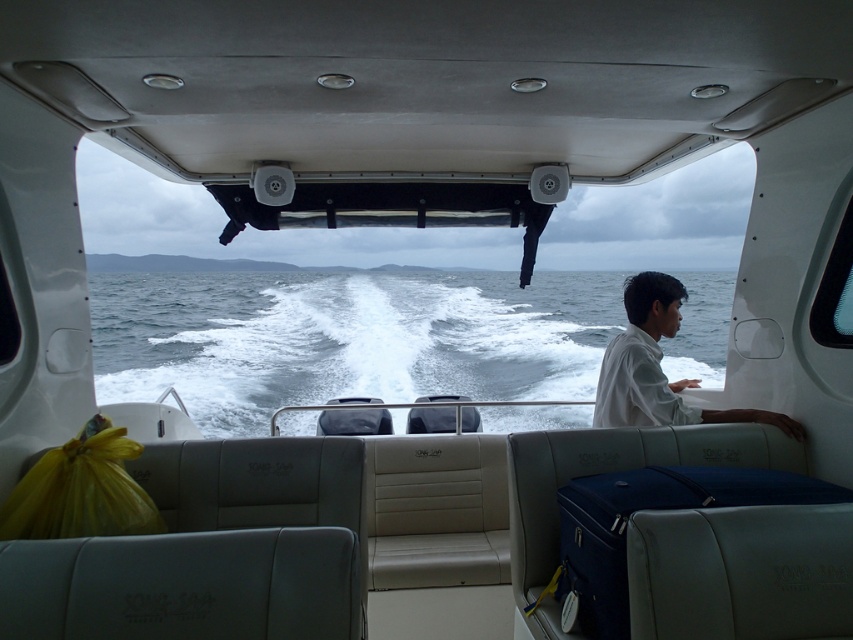
Who is lower down, white foamy water at center or white matte shirt at right?

white matte shirt at right

Who is more forward, [683,314] or [752,408]?

Point [752,408] is more forward.

Is point (520, 419) more distant than point (618, 403)?

Yes, point (520, 419) is behind point (618, 403).

Where is `white foamy water at center`? Image resolution: width=853 pixels, height=640 pixels. white foamy water at center is located at coordinates coord(346,337).